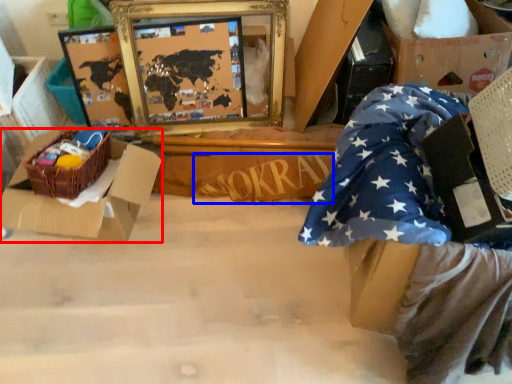
Question: Which point is further to the camera, box (highlighted by a red box) or writing (highlighted by a blue box)?

Choices:
 (A) box
 (B) writing

Answer: (B)